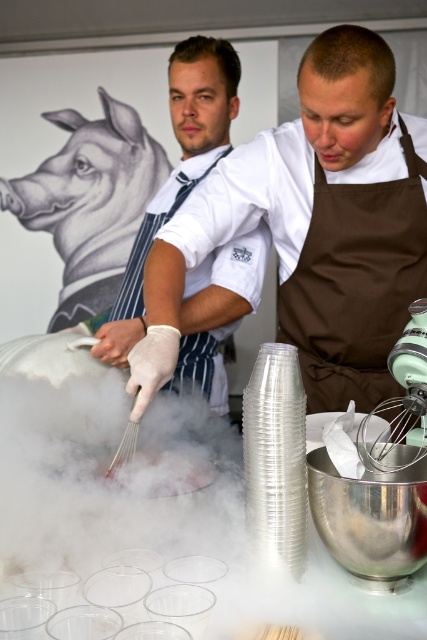
You are a chef standing at the edge of the table. You need to reach the white striped apron at center. Which direction should you move to get closer to it?

The white striped apron at center is located at point 0.264 on the x axis and 0.417 on the y axis. Since you are at the edge of the table, you should move towards the center of the table to reach it.

In the scene shown: You are a food critic attending a cooking demo and need to describe the positions of two points marked on the table. The first point is at coordinate point(318, 480) and the second is at point(119, 461). From your perspective facing the table, which point is closer to you?

Point(119, 461) is closer to you because it is behind point(318, 480).

From the picture: You are a guest at the event and want to know which item is closer to you. Can you tell me which one is nearer between the white matte glove at left and the white striped apron at center?

The white matte glove at left is closer to you because it is in front of the white striped apron at center.